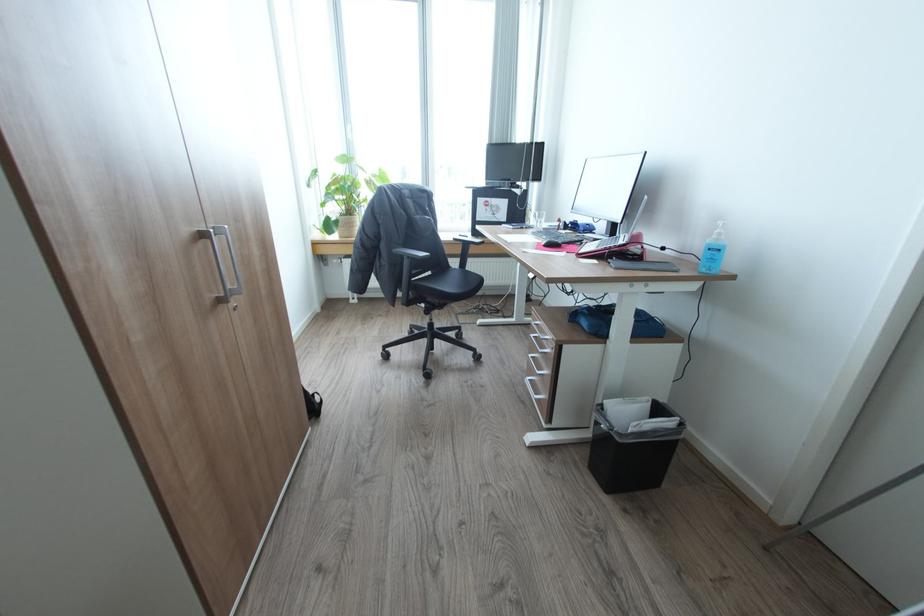
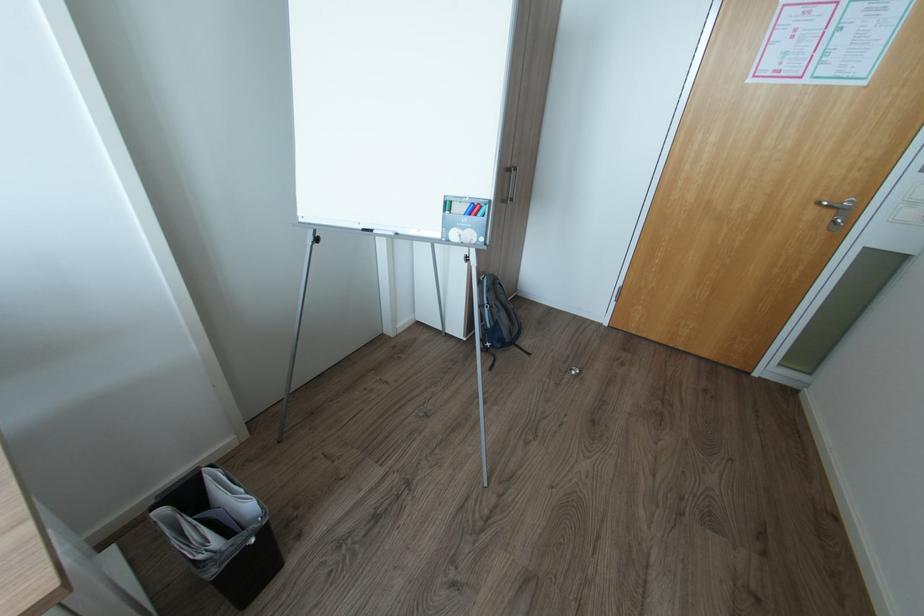
Where in the second image is the point corresponding to (608,426) from the first image?

(257, 541)